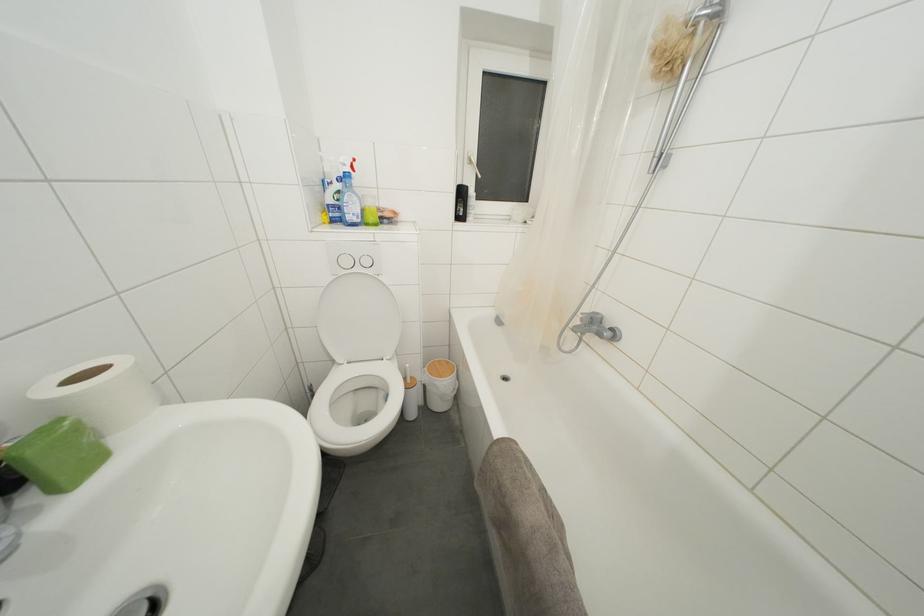
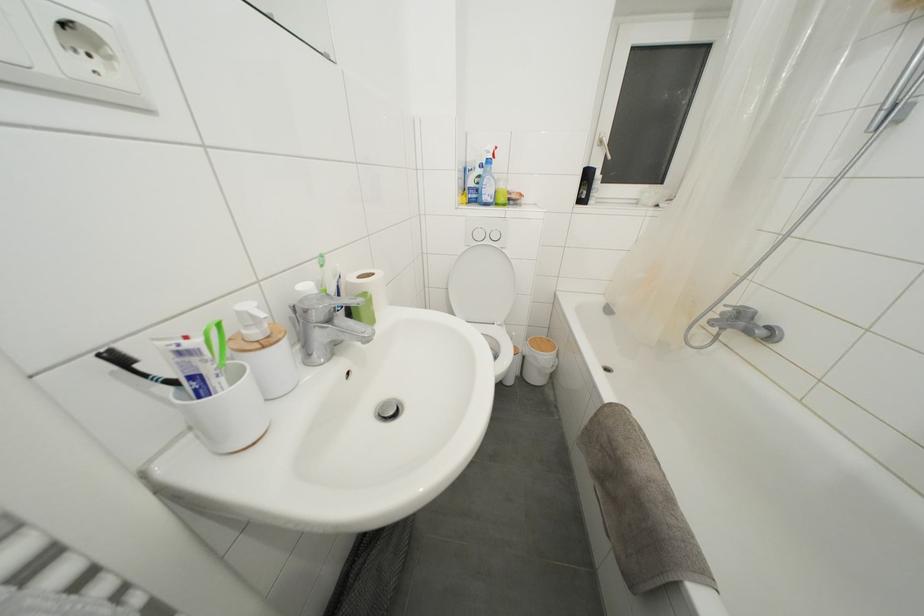
Question: The images are taken continuously from a first-person perspective. In which direction is your viewpoint rotating?

Choices:
 (A) Left
 (B) Right
 (C) Up
 (D) Down

Answer: (A)